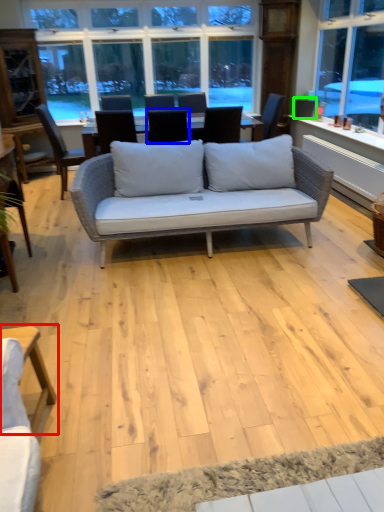
Question: Considering the real-world distances, which object is farthest from table (highlighted by a red box)? chair (highlighted by a blue box) or armchair (highlighted by a green box)?

Choices:
 (A) chair
 (B) armchair

Answer: (B)